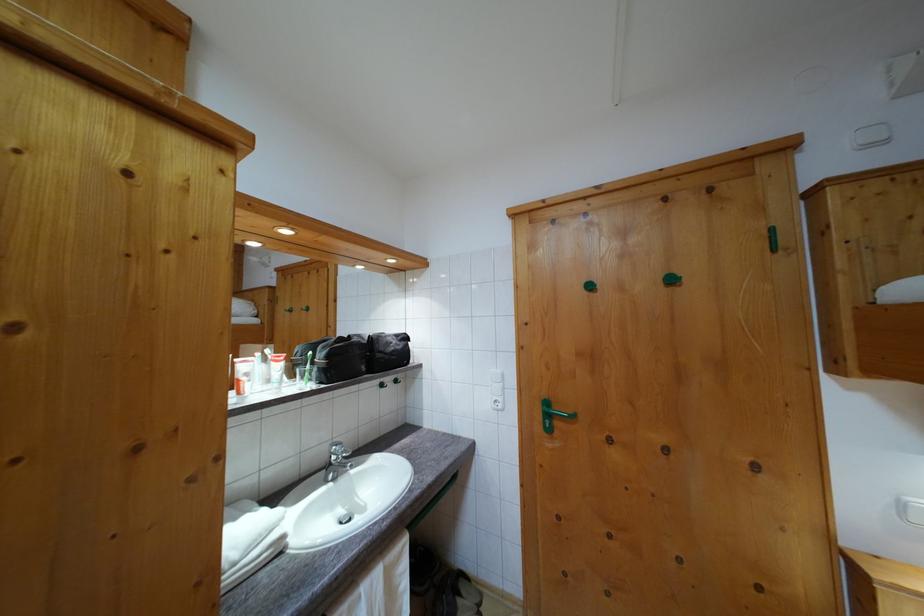
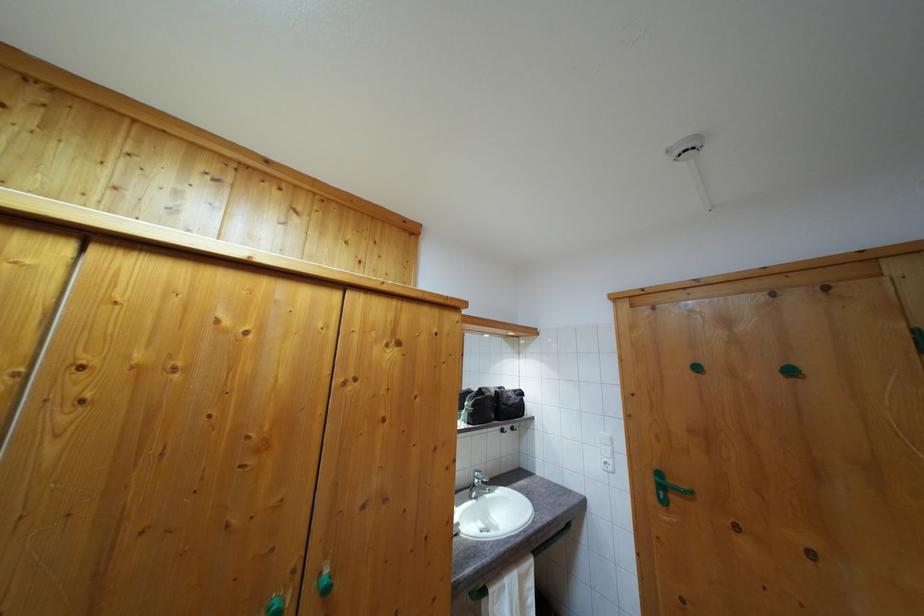
Find the pixel in the second image that matches [400,342] in the first image.

(518, 398)